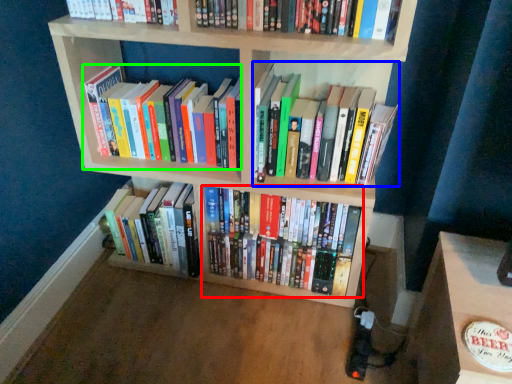
Question: Which object is positioned farthest from book (highlighted by a red box)? Select from book (highlighted by a blue box) and book (highlighted by a green box).

Choices:
 (A) book
 (B) book

Answer: (A)